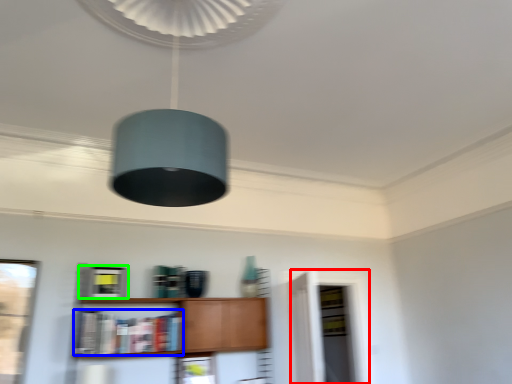
Question: Which object is the closest to the glass door (highlighted by a red box)? Choose among these: book (highlighted by a blue box) or cabinetry (highlighted by a green box).

Choices:
 (A) book
 (B) cabinetry

Answer: (A)